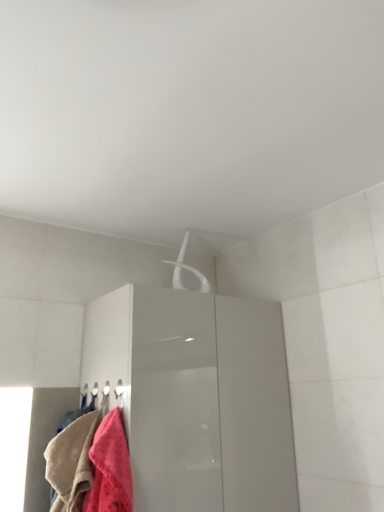
Question: Is fluffy pink towel at lower left located outside glossy white cabinet at upper center?

Choices:
 (A) no
 (B) yes

Answer: (B)

Question: Is fluffy pink towel at lower left oriented towards glossy white cabinet at upper center?

Choices:
 (A) no
 (B) yes

Answer: (A)

Question: Is fluffy pink towel at lower left thinner than glossy white cabinet at upper center?

Choices:
 (A) yes
 (B) no

Answer: (A)

Question: From the image's perspective, does fluffy pink towel at lower left appear higher than glossy white cabinet at upper center?

Choices:
 (A) yes
 (B) no

Answer: (A)

Question: From a real-world perspective, is fluffy pink towel at lower left located beneath glossy white cabinet at upper center?

Choices:
 (A) no
 (B) yes

Answer: (B)

Question: Is fluffy pink towel at lower left taller than glossy white cabinet at upper center?

Choices:
 (A) yes
 (B) no

Answer: (B)

Question: Is glossy white cabinet at upper center taller than fluffy pink towel at lower left?

Choices:
 (A) no
 (B) yes

Answer: (B)

Question: Considering the relative positions of glossy white cabinet at upper center and fluffy pink towel at lower left in the image provided, is glossy white cabinet at upper center in front of fluffy pink towel at lower left?

Choices:
 (A) no
 (B) yes

Answer: (A)

Question: Is glossy white cabinet at upper center not inside fluffy pink towel at lower left?

Choices:
 (A) no
 (B) yes

Answer: (B)

Question: Could you tell me if glossy white cabinet at upper center is facing fluffy pink towel at lower left?

Choices:
 (A) yes
 (B) no

Answer: (B)

Question: Is glossy white cabinet at upper center smaller than fluffy pink towel at lower left?

Choices:
 (A) no
 (B) yes

Answer: (A)

Question: Is glossy white cabinet at upper center shorter than fluffy pink towel at lower left?

Choices:
 (A) no
 (B) yes

Answer: (A)

Question: Is point (82, 456) closer or farther from the camera than point (203, 497)?

Choices:
 (A) farther
 (B) closer

Answer: (B)